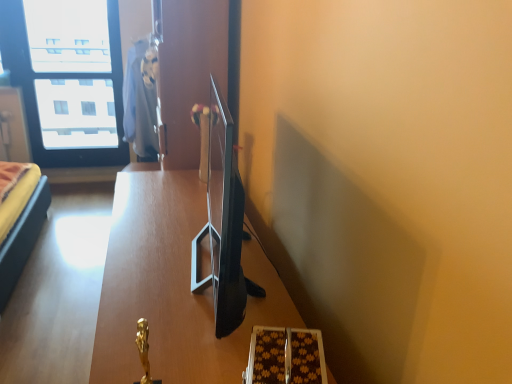
Question: Is wooden table at center in front of or behind transparent glass window at upper left in the image?

Choices:
 (A) behind
 (B) front

Answer: (B)

Question: Is wooden table at center inside the boundaries of transparent glass window at upper left, or outside?

Choices:
 (A) inside
 (B) outside

Answer: (B)

Question: Which object is the closest to the wooden table at center?

Choices:
 (A) matte blue robe at upper center
 (B) transparent glass window at upper left

Answer: (A)

Question: Estimate the real-world distances between objects in this image. Which object is farther from the transparent glass window at upper left?

Choices:
 (A) matte blue robe at upper center
 (B) wooden table at center

Answer: (B)